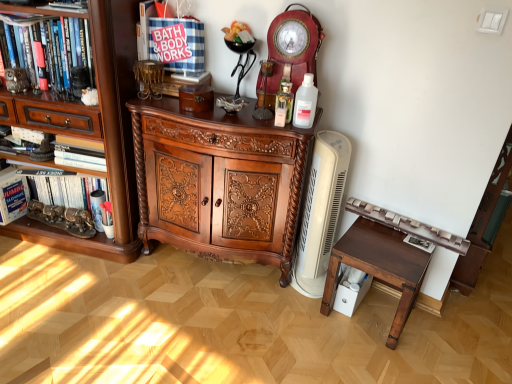
Where is `free area in between dark wood carved cabinet at center and brown wood cabinet at left`? This screenshot has height=384, width=512. free area in between dark wood carved cabinet at center and brown wood cabinet at left is located at coordinates (187, 279).